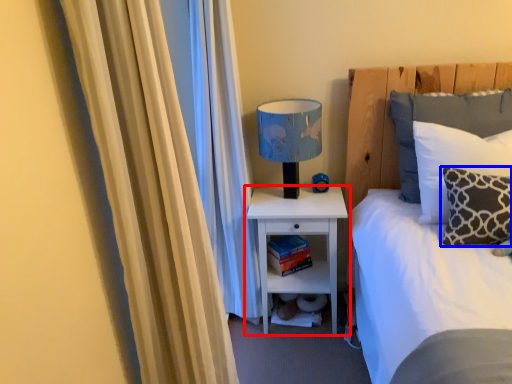
Question: Which object is further to the camera taking this photo, nightstand (highlighted by a red box) or pillow (highlighted by a blue box)?

Choices:
 (A) nightstand
 (B) pillow

Answer: (A)